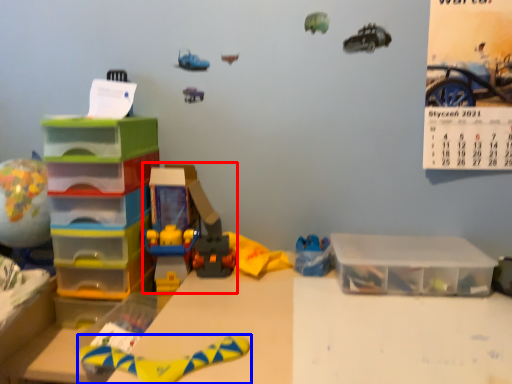
Question: Among these objects, which one is nearest to the camera, toy (highlighted by a red box) or toy (highlighted by a blue box)?

Choices:
 (A) toy
 (B) toy

Answer: (B)